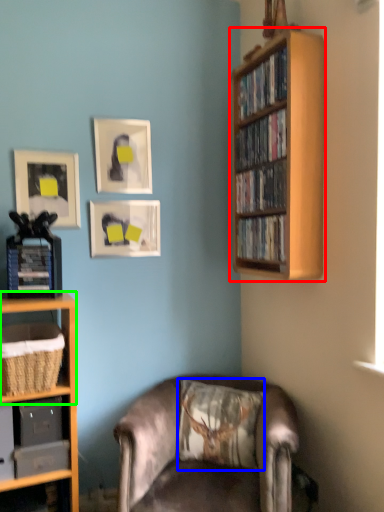
Question: Which object is the farthest from bookcase (highlighted by a red box)? Choose among these: pillow (highlighted by a blue box) or shelf (highlighted by a green box).

Choices:
 (A) pillow
 (B) shelf

Answer: (B)